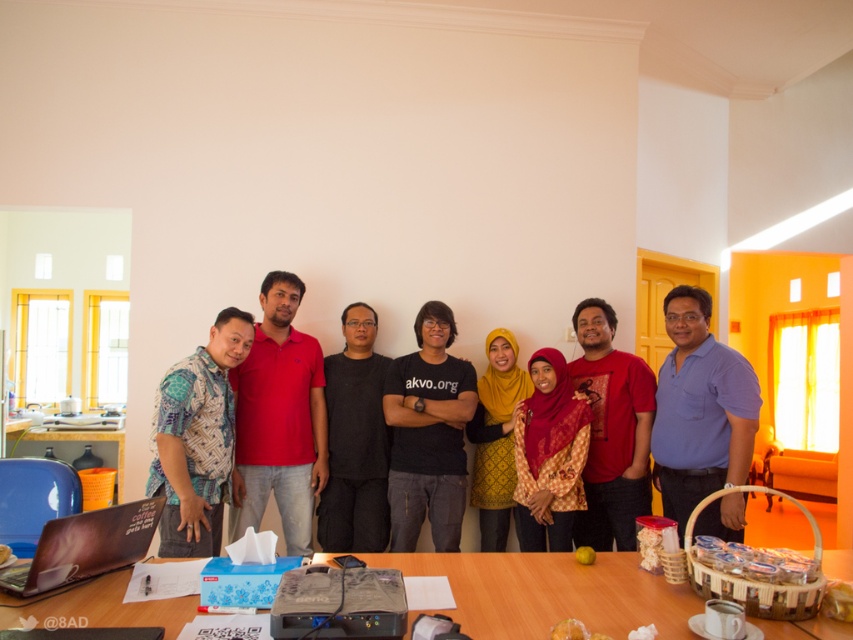
You are standing in the room and want to move from the point at coordinates point (x=746, y=442) to the point at coordinates point (x=378, y=364). Which direction should you move to get closer to your destination?

Since point (x=746, y=442) is closer to the viewer than point (x=378, y=364), you should move backward to get closer to your destination.

You are standing in the room and want to move from the point at coordinate (x=238, y=349) to the point at coordinate (x=486, y=342). Which direction should you move to reach your destination?

You should move backward to reach the point at coordinate (x=486, y=342) because point (x=238, y=349) is in front of it.

You are organizing a clothing donation drive and need to categorize shirts by size. You have two shirts to sort out. The blue cotton shirt at right and the black matte shirt at center. Which shirt is bigger in width?

The blue cotton shirt at right is larger in width than the black matte shirt at center according to the description.